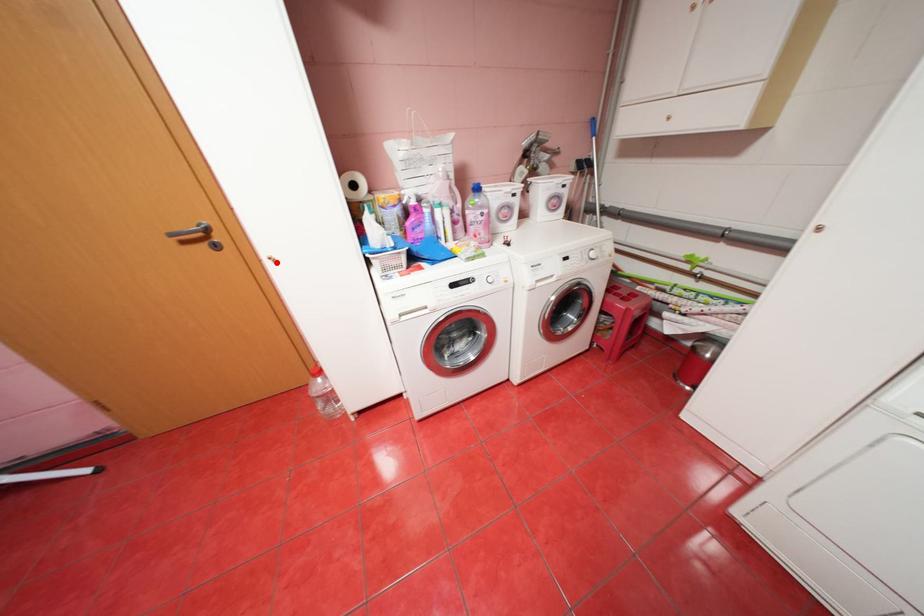
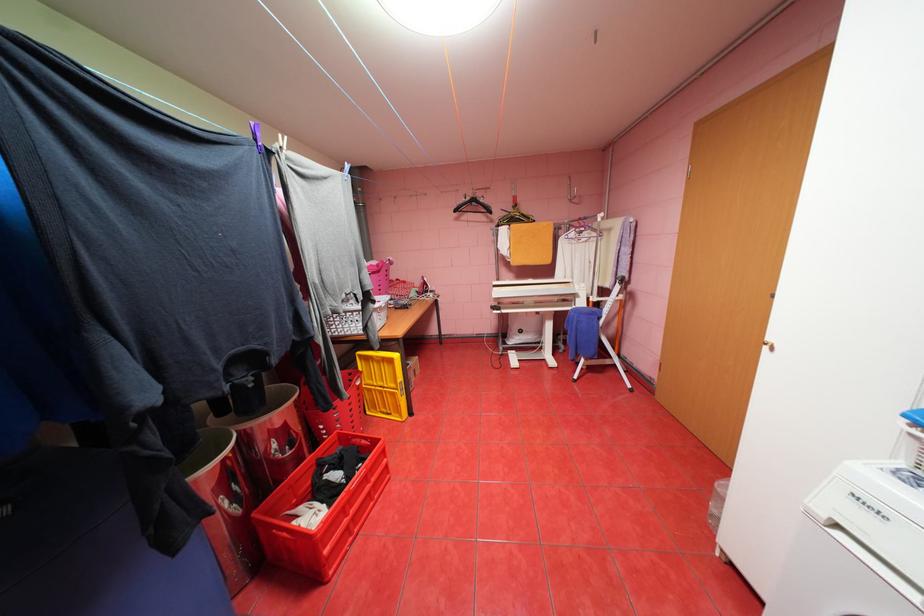
Find the pixel in the second image that matches the highlighted location in the first image.

(774, 347)